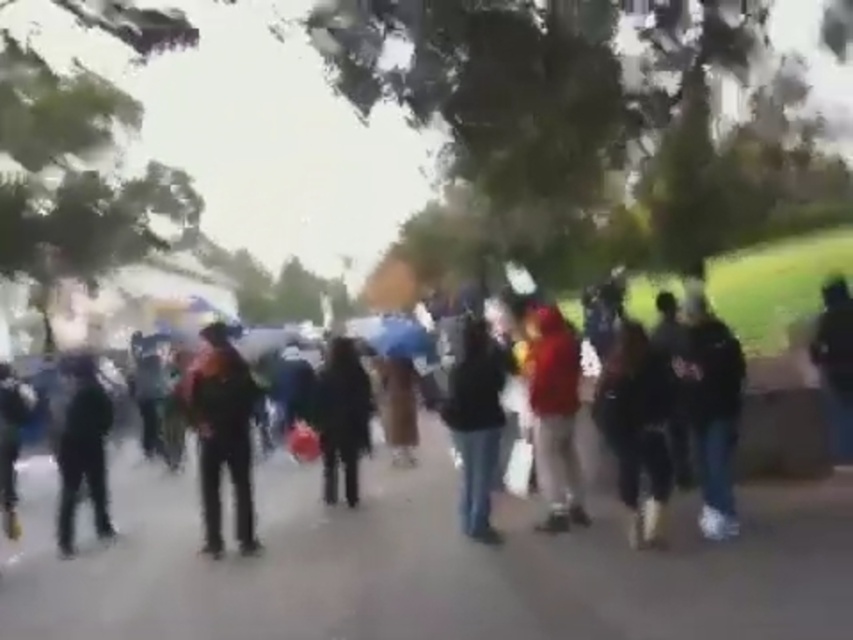
Looking at this image, is dark blue jeans at center positioned in front of black matte jacket at center?

Yes.

Locate an element on the screen. dark blue jeans at center is located at coordinates (x=476, y=420).

Between point (228, 451) and point (463, 324), which one is positioned in front?

Point (228, 451) is in front.

Find the location of a particular element. dark brown leather jacket at left is located at coordinates (221, 432).

The width and height of the screenshot is (853, 640). I want to click on dark brown leather jacket at left, so click(221, 432).

Is dark clothing crowd at center further to camera compared to black matte jacket at center?

That is False.

Who is higher up, dark clothing crowd at center or black matte jacket at center?

Positioned higher is black matte jacket at center.

Is point (694, 529) positioned behind point (355, 452)?

That is False.

Identify the location of dark clothing crowd at center. tap(779, 424).